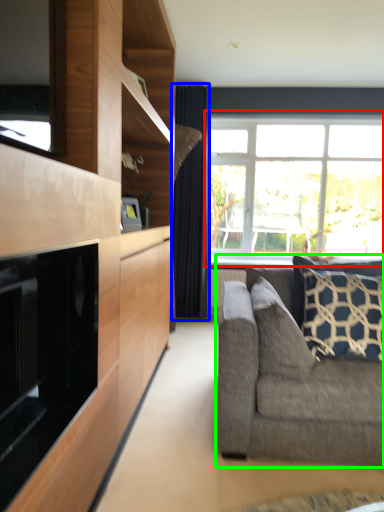
Question: Which is nearer to the window (highlighted by a red box)? curtain (highlighted by a blue box) or studio couch (highlighted by a green box).

Choices:
 (A) curtain
 (B) studio couch

Answer: (A)